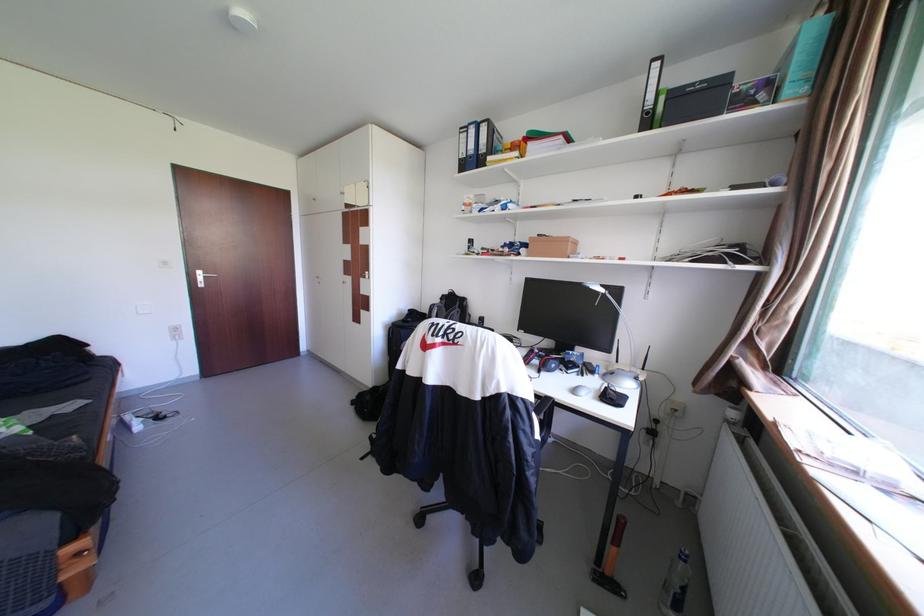
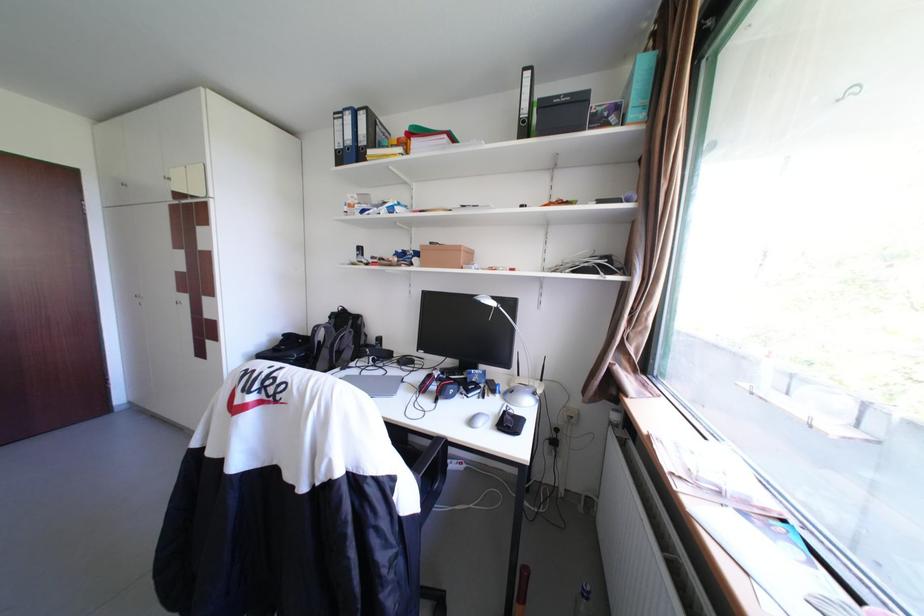
Locate, in the second image, the point that corresponds to [541,238] in the first image.

(432, 246)